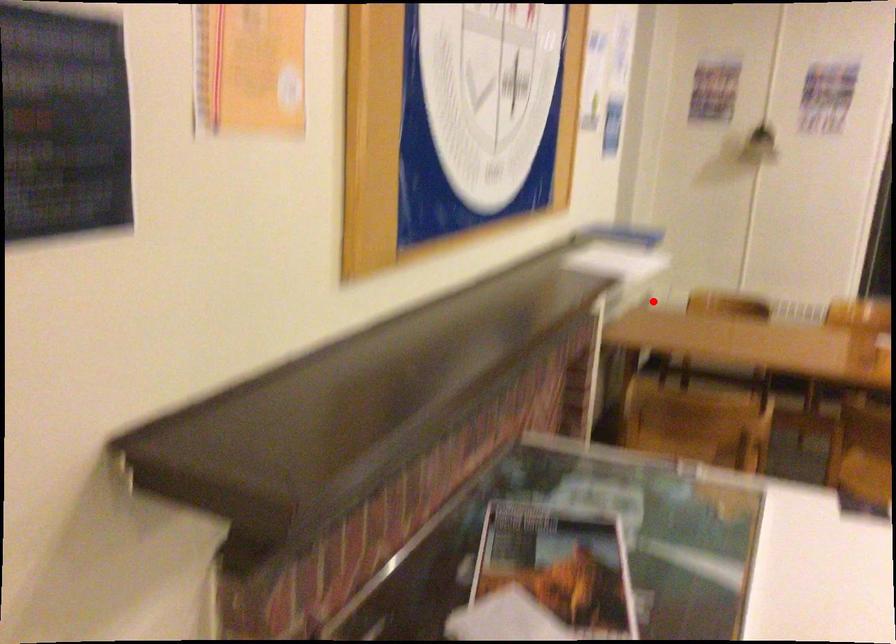
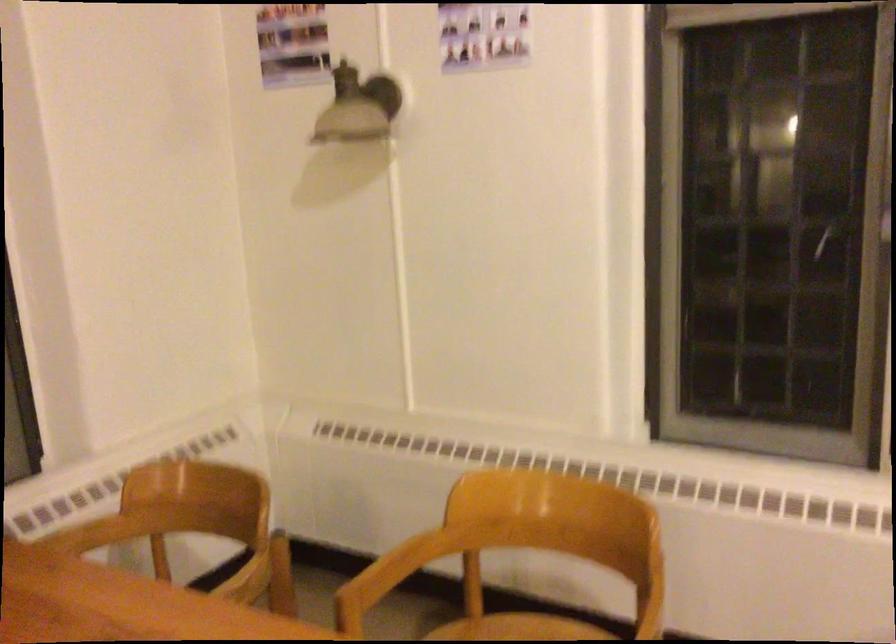
Locate, in the second image, the point that corresponds to the highlighted location in the first image.

(92, 534)